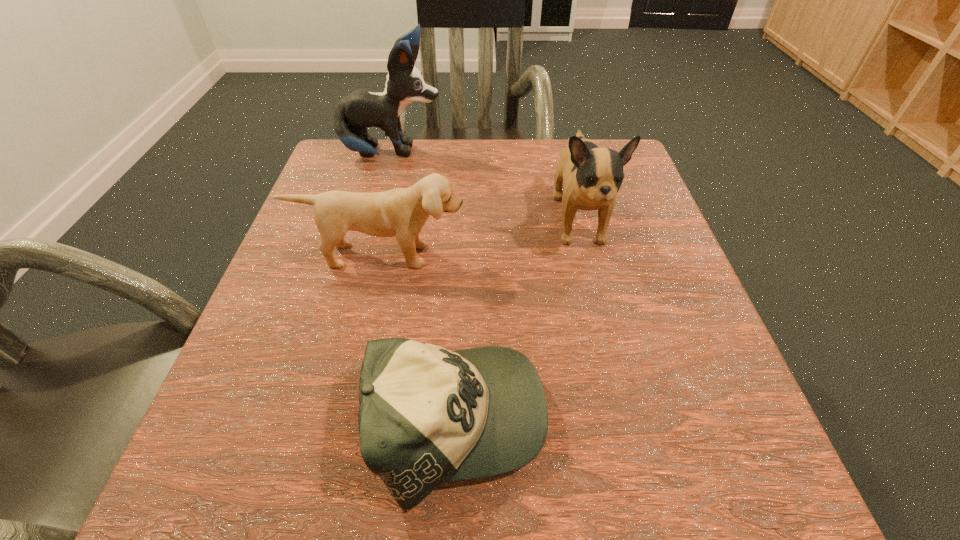
Where is `vacant area at the far right corner`? This screenshot has width=960, height=540. vacant area at the far right corner is located at coordinates (644, 186).

Where is `free spot between the farthest object and the second shortest puppy`? Image resolution: width=960 pixels, height=540 pixels. free spot between the farthest object and the second shortest puppy is located at coordinates (486, 187).

Where is `vacant space that is in between the third tallest object and the shortest object`? vacant space that is in between the third tallest object and the shortest object is located at coordinates (419, 339).

Identify the location of unoccupied position between the tallest object and the rightmost puppy. The image size is (960, 540). (486, 187).

At what (x,y) coordinates should I click in order to perform the action: click on free space between the shortest puppy and the second shortest puppy. Please return your answer as a coordinate pair (x, y). This screenshot has width=960, height=540. Looking at the image, I should click on (480, 238).

The image size is (960, 540). Find the location of `vacant area that lies between the farthest object and the baseball cap`. vacant area that lies between the farthest object and the baseball cap is located at coordinates (424, 288).

Identify the location of vacant area that lies between the second shortest puppy and the shortest object. The image size is (960, 540). (517, 321).

At what (x,y) coordinates should I click in order to perform the action: click on object that is the closest to the second shortest object. Please return your answer as a coordinate pair (x, y). Looking at the image, I should click on (592, 175).

At what (x,y) coordinates should I click in order to perform the action: click on the second closest object to the second tallest puppy. Please return your answer as a coordinate pair (x, y). Looking at the image, I should click on (427, 415).

I want to click on the closest puppy to the shortest puppy, so click(x=592, y=175).